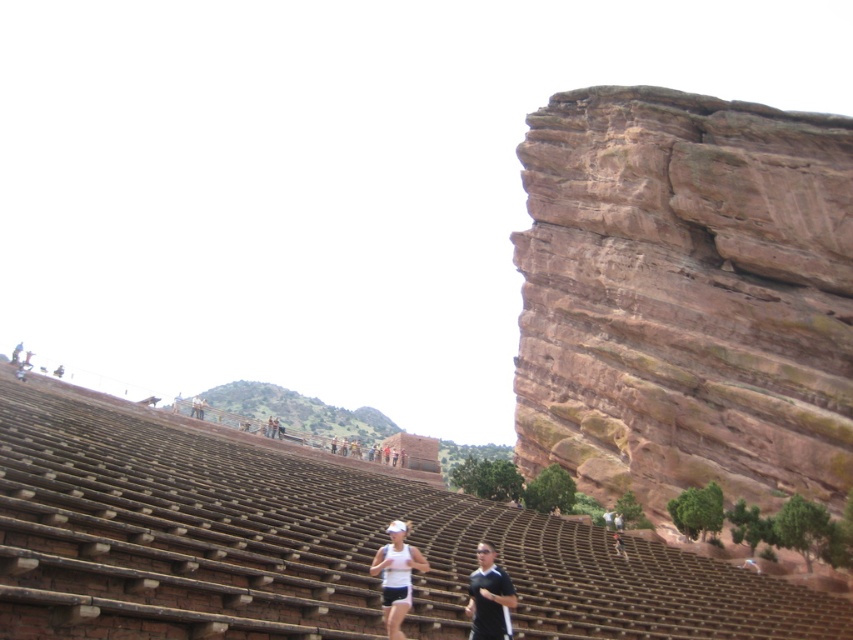
You are a photographer setting up a shoot in the amphitheater. You need to ensure that the white matte tank top at center and the black fabric shirt at center are clearly visible in the frame. Considering their sizes, which clothing item should you focus on to ensure it stands out more in the photo?

The white matte tank top at center has a larger size compared to the black fabric shirt at center, so focusing on the white matte tank top at center will help it stand out more in the photo due to its bigger size.

You are standing at the base of the amphitheater and see the rustic stone cliff at right and the black fabric shirt at center. Which object is positioned more to the east if the amphitheater faces north?

The rustic stone cliff at right is positioned more to the east since it is to the right of the black fabric shirt at center, and if the amphitheater faces north, the right side would correspond to the east direction.